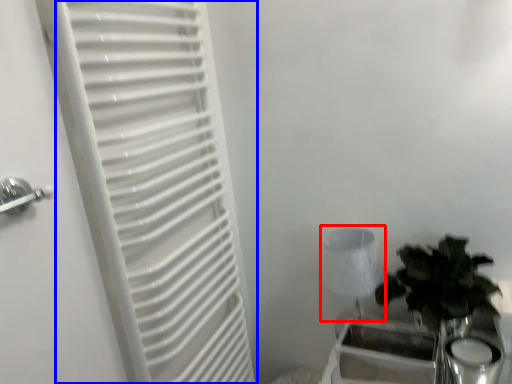
Question: Which of the following is the farthest to the observer, lamp (highlighted by a red box) or curtain (highlighted by a blue box)?

Choices:
 (A) lamp
 (B) curtain

Answer: (A)